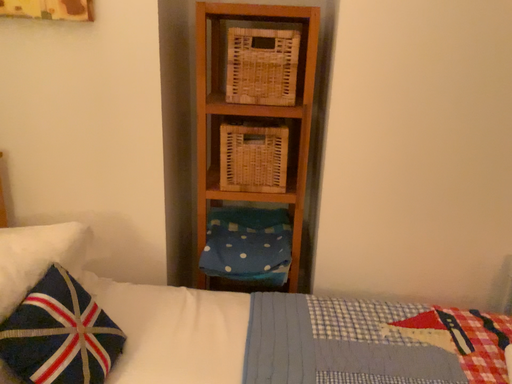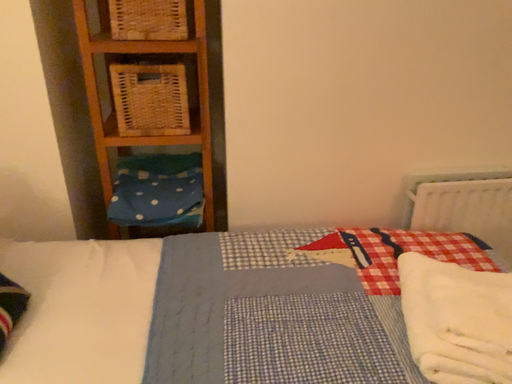
Question: How did the camera likely rotate when shooting the video?

Choices:
 (A) rotated left
 (B) rotated right

Answer: (B)